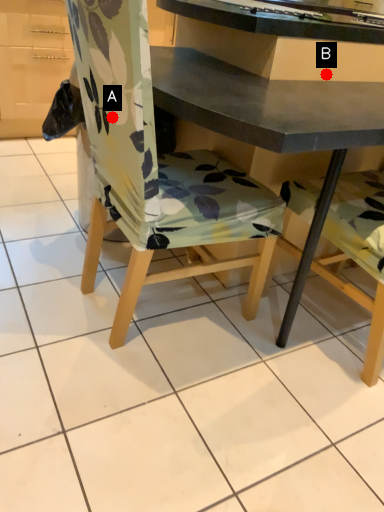
Question: Two points are circled on the image, labeled by A and B beside each circle. Which point is closer to the camera?

Choices:
 (A) A is closer
 (B) B is closer

Answer: (A)